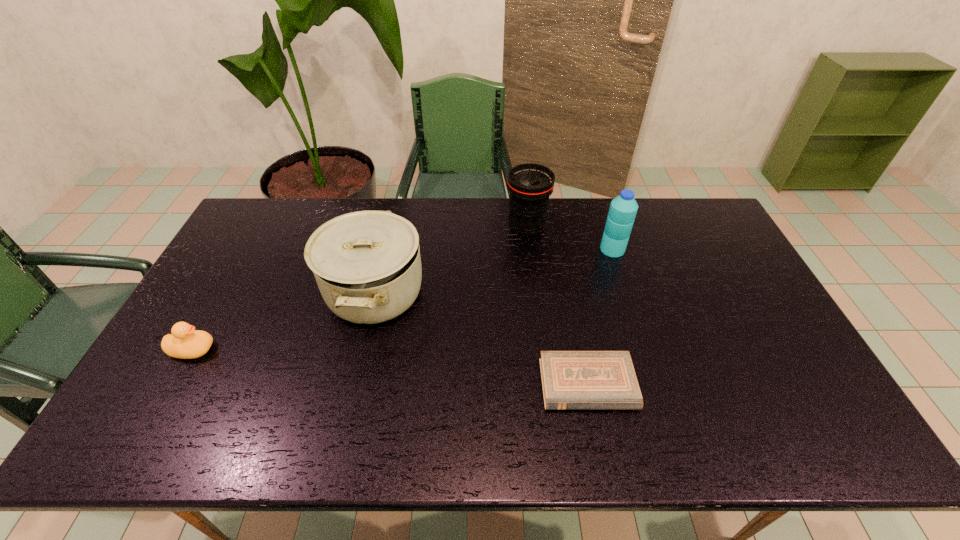
The width and height of the screenshot is (960, 540). I want to click on free space between the telephoto lens and the Bible, so click(557, 306).

Identify the location of free space between the Bible and the water bottle. The width and height of the screenshot is (960, 540). (600, 317).

At what (x,y) coordinates should I click in order to perform the action: click on free area in between the fourth tallest object and the shortest object. Please return your answer as a coordinate pair (x, y). Image resolution: width=960 pixels, height=540 pixels. Looking at the image, I should click on (390, 367).

Where is `vacant space in between the saucepan and the water bottle`? vacant space in between the saucepan and the water bottle is located at coordinates (493, 271).

This screenshot has height=540, width=960. I want to click on empty location between the Bible and the second object from left to right, so click(481, 339).

The image size is (960, 540). Find the location of `free spot between the second shortest object and the saucepan`. free spot between the second shortest object and the saucepan is located at coordinates (283, 321).

Locate an element on the screen. vacant area between the Bible and the second object from left to right is located at coordinates (481, 339).

Locate which object is the second closest to the second object from left to right. Please provide its 2D coordinates. Your answer should be formatted as a tuple, i.e. [(x, y)], where the tuple contains the x and y coordinates of a point satisfying the conditions above.

[(530, 185)]

This screenshot has height=540, width=960. What are the coordinates of `object that stands as the second closest to the second object from left to right` in the screenshot? It's located at (530, 185).